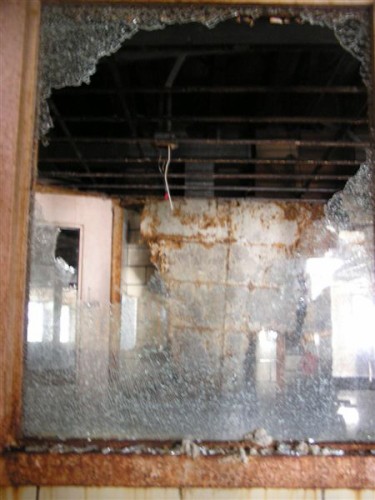
Where is `glass in door`? The width and height of the screenshot is (375, 500). glass in door is located at coordinates (63, 234), (58, 333), (43, 328), (44, 250).